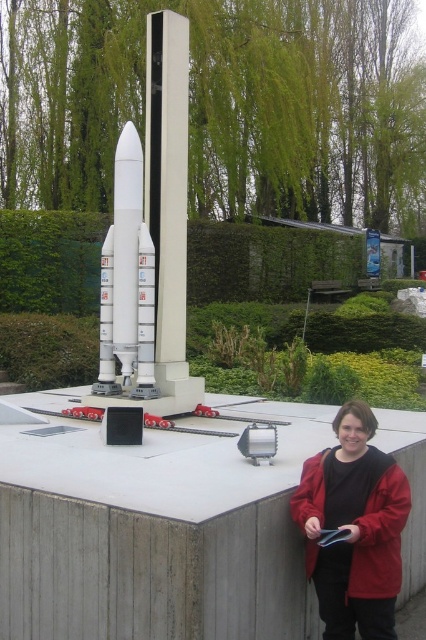
Question: From the image, what is the correct spatial relationship of black fabric jacket at lower right in relation to white matte rocket at center?

Choices:
 (A) left
 (B) right

Answer: (B)

Question: Which of these objects is positioned farthest from the black fabric jacket at lower right?

Choices:
 (A) white matte rocket at center
 (B) metallic clipboard at lower right

Answer: (A)

Question: Is white matte rocket at center further to the viewer compared to metallic clipboard at lower right?

Choices:
 (A) yes
 (B) no

Answer: (A)

Question: Is black fabric jacket at lower right below metallic clipboard at lower right?

Choices:
 (A) no
 (B) yes

Answer: (A)

Question: Considering the real-world distances, which object is farthest from the white matte rocket at center?

Choices:
 (A) black fabric jacket at lower right
 (B) metallic clipboard at lower right

Answer: (B)

Question: Which point is farther to the camera?

Choices:
 (A) metallic clipboard at lower right
 (B) white matte rocket at center
 (C) black fabric jacket at lower right

Answer: (B)